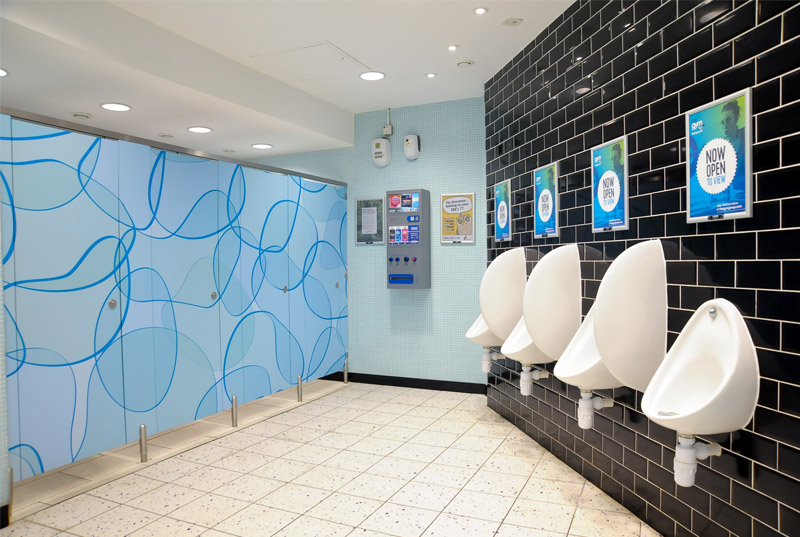
Where is `toilet door handle`? The width and height of the screenshot is (800, 537). toilet door handle is located at coordinates (114, 304), (217, 297), (285, 287), (341, 284).